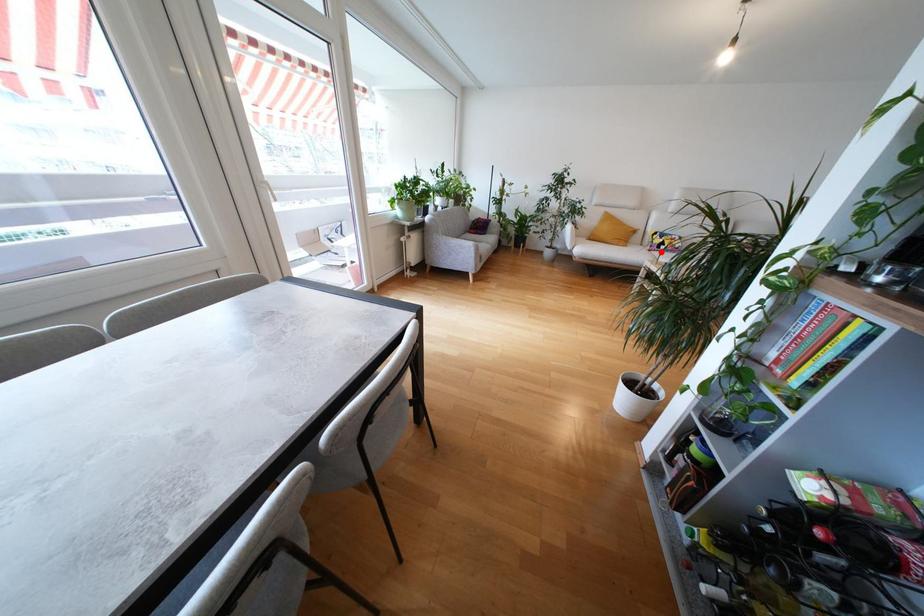
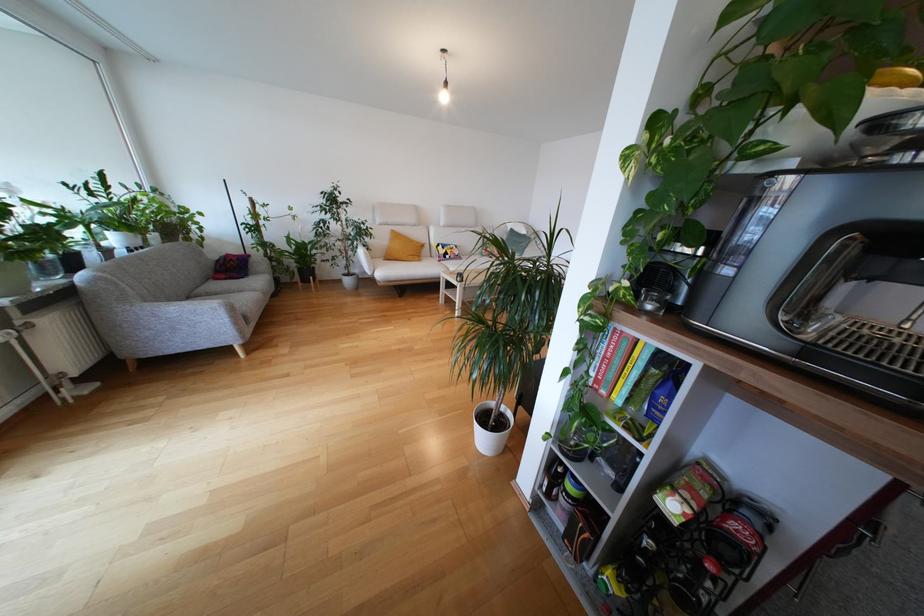
Question: I am providing you with two images of the same scene from different viewpoints. A red point is shown in image1. For the corresponding object point in image2, is it positioned nearer or farther from the camera?

Choices:
 (A) Nearer
 (B) Farther

Answer: (B)